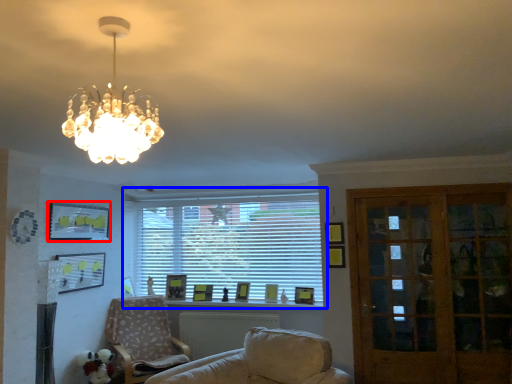
Question: Which of the following is the farthest to the observer, picture frame (highlighted by a red box) or window (highlighted by a blue box)?

Choices:
 (A) picture frame
 (B) window

Answer: (B)